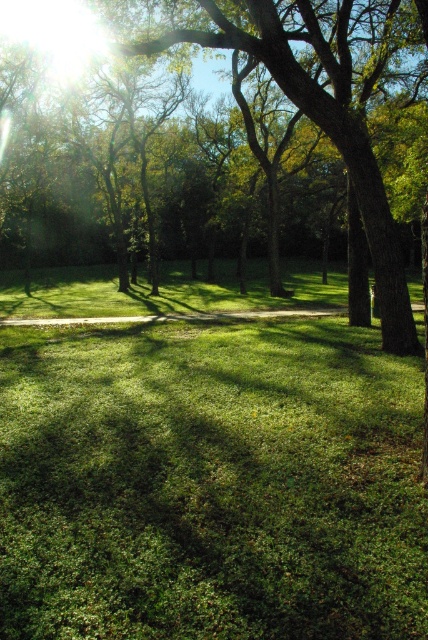
Is green grassy at center wider than green leafy tree at center?

Yes.

Can you confirm if green grassy at center is taller than green leafy tree at center?

No.

Identify the location of green grassy at center. (210, 483).

The width and height of the screenshot is (428, 640). What are the coordinates of `green grassy at center` in the screenshot? It's located at (210, 483).